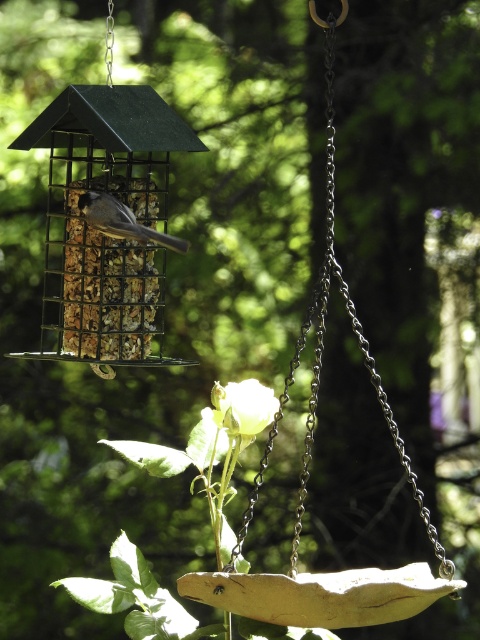
Question: Which object appears farthest from the camera in this image?

Choices:
 (A) white matte rose at center
 (B) gray matte bird at center
 (C) metallic silver chain at center

Answer: (B)

Question: Where is white matte rose at center located in relation to gray matte bird at center in the image?

Choices:
 (A) left
 (B) right

Answer: (B)

Question: Which point is farther to the camera?

Choices:
 (A) metallic silver chain at center
 (B) gray matte bird at center
 (C) white matte rose at center

Answer: (B)

Question: Observing the image, what is the correct spatial positioning of metallic silver chain at center in reference to white matte rose at center?

Choices:
 (A) above
 (B) below

Answer: (A)

Question: Which of the following is the farthest from the observer?

Choices:
 (A) (303, 445)
 (B) (240, 413)

Answer: (A)

Question: Where is metallic silver chain at center located in relation to white matte rose at center in the image?

Choices:
 (A) above
 (B) below

Answer: (A)